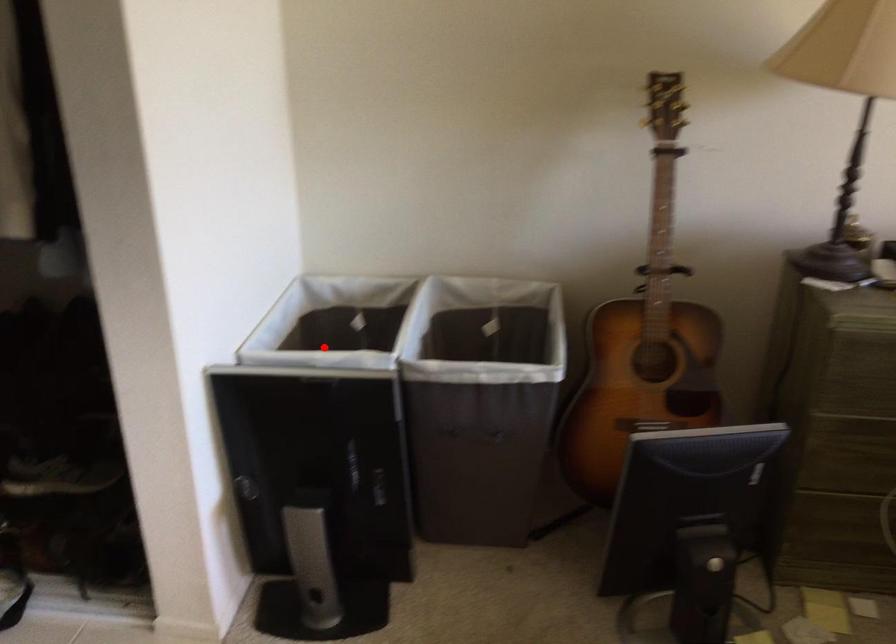
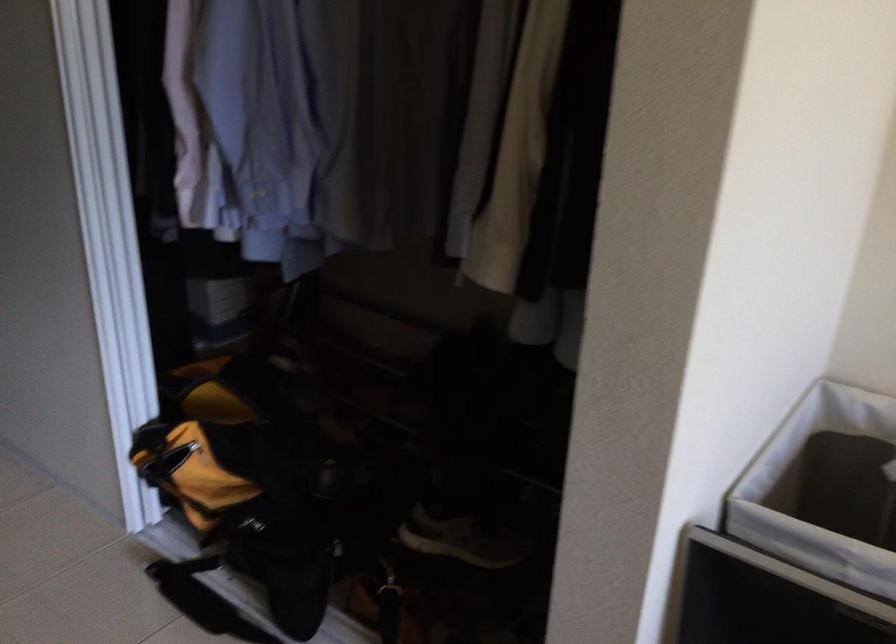
In the second image, find the point that corresponds to the highlighted location in the first image.

(824, 489)